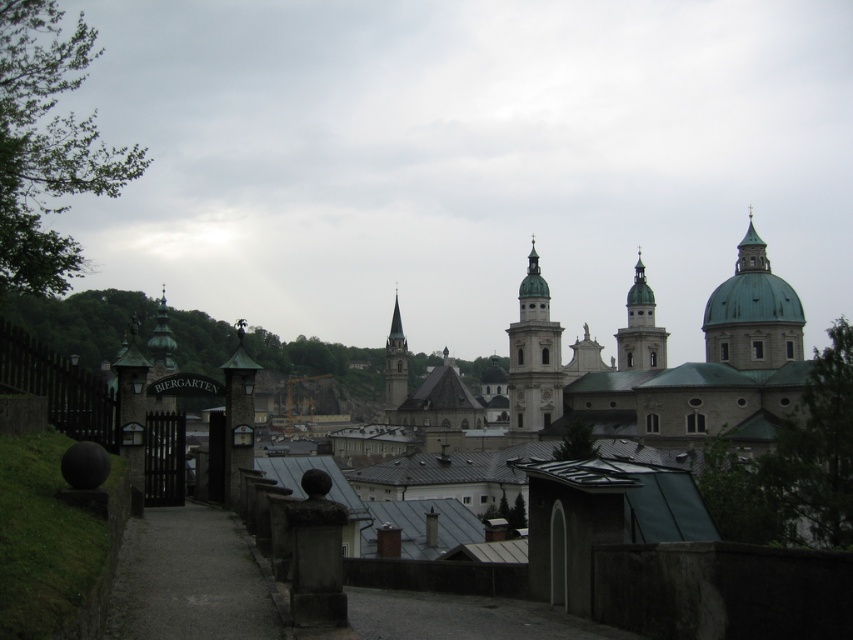
Is the position of matte stone town at center more distant than that of smooth white tower at center?

No, matte stone town at center is closer to the viewer.

Which of these two, matte stone town at center or smooth white tower at center, stands taller?

With more height is smooth white tower at center.

Is point (659, 600) positioned behind point (631, 337)?

No.

Where is `matte stone town at center`? This screenshot has height=640, width=853. matte stone town at center is located at coordinates (703, 580).

Is point (613, 595) behind point (763, 342)?

No, it is not.

Which is behind, point (630, 580) or point (755, 344)?

The point (755, 344) is more distant.

Does point (639, 369) lie in front of point (740, 243)?

No, it is behind (740, 243).

Locate an element on the screen. This screenshot has height=640, width=853. matte stone town at center is located at coordinates (703, 580).

Is gray gravel path at lower left taller than smooth white tower at center?

No, gray gravel path at lower left is not taller than smooth white tower at center.

Which is behind, point (190, 595) or point (643, 348)?

Point (643, 348)

The width and height of the screenshot is (853, 640). Find the location of `gray gravel path at lower left`. gray gravel path at lower left is located at coordinates (189, 579).